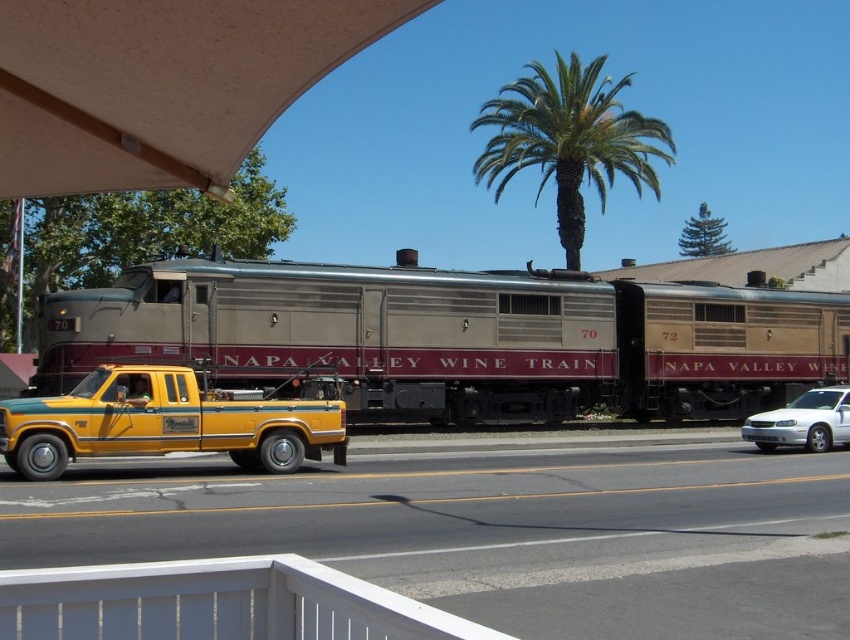
You are a photographer planning to take a picture of the vintage Napa Valley Wine Train and the yellow pickup truck. To ensure both are in the frame, where should you position the green leafy palm tree at upper center relative to the camera?

The green leafy palm tree at upper center is located at coordinates point (x=570, y=140), so positioning the camera so that the palm tree is slightly to the left and upper part of the frame will ensure both the train and the truck are included in the shot.

You are a delivery driver who needs to park your truck between the green leafy palm tree at upper center and the white glossy sedan at center. The length of your truck is 6 meters. Can you safely park your truck in this space?

The distance between the green leafy palm tree at upper center and the white glossy sedan at center is 46.01 meters. Since your truck is only 6 meters long, there is sufficient space to park safely between them.